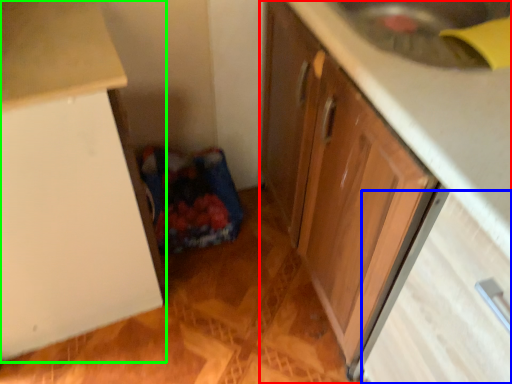
Question: Which object is the closest to the cabinetry (highlighted by a red box)? Choose among these: drawer (highlighted by a blue box) or cabinetry (highlighted by a green box).

Choices:
 (A) drawer
 (B) cabinetry

Answer: (A)